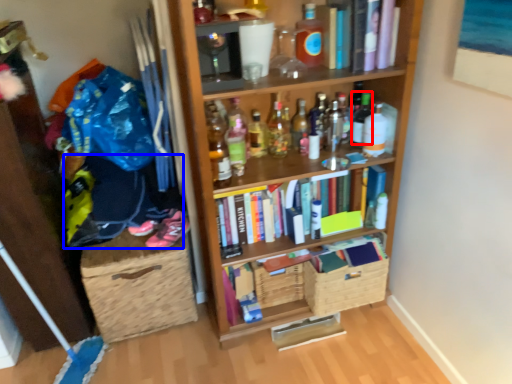
Question: Which of the following is the farthest to the observer, bottle (highlighted by a red box) or clothing (highlighted by a blue box)?

Choices:
 (A) bottle
 (B) clothing

Answer: (A)